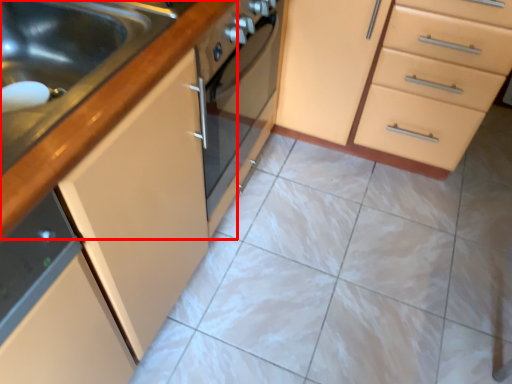
Question: Where is countertop (annotated by the red box) located in relation to cabinetry in the image?

Choices:
 (A) left
 (B) right

Answer: (A)